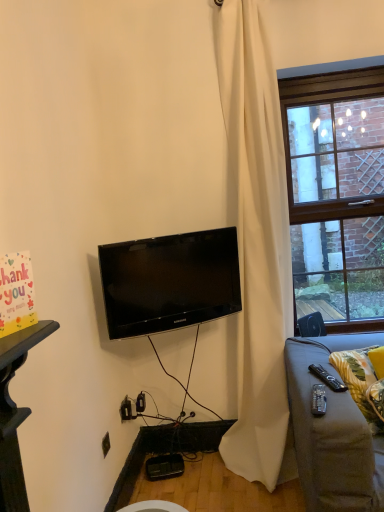
Find the location of a particular element. This screenshot has width=384, height=512. black plastic remote control at lower right, which appears as the first remote control when viewed from the right is located at coordinates (327, 378).

Measure the distance between point (x=342, y=352) and camera.

They are 6.04 feet apart.

Describe the element at coordinates (256, 243) in the screenshot. I see `white matte curtain at center` at that location.

Find the location of a particular element. Image resolution: width=384 pixels, height=512 pixels. black plastic remote control at lower right, marked as the 2th remote control in a back-to-front arrangement is located at coordinates (318, 400).

At what (x,y) coordinates should I click in order to perform the action: click on black plastic remote control at lower right, which ranks as the first remote control in back-to-front order. Please return your answer as a coordinate pair (x, y). This screenshot has height=512, width=384. Looking at the image, I should click on (327, 378).

Measure the distance from brick wall at right to white matte curtain at center.

brick wall at right is 17.11 inches away from white matte curtain at center.

From the image's perspective, is brick wall at right positioned above or below white matte curtain at center?

Clearly, from the image's perspective, brick wall at right is above white matte curtain at center.

Which of these two, brick wall at right or white matte curtain at center, is smaller?

Smaller between the two is brick wall at right.

Is white matte curtain at center located within brick wall at right?

No, white matte curtain at center is not surrounded by brick wall at right.

Considering the relative positions of black glossy tv at center and white matte curtain at center in the image provided, is black glossy tv at center to the left or to the right of white matte curtain at center?

From the image, it's evident that black glossy tv at center is to the left of white matte curtain at center.

Is black glossy tv at center touching white matte curtain at center?

No, black glossy tv at center is not making contact with white matte curtain at center.

Is black glossy tv at center not within white matte curtain at center?

Actually, black glossy tv at center is at least partially inside white matte curtain at center.

Is point (319, 386) positioned in front of point (363, 355)?

Yes.

Can you confirm if black plastic remote control at lower right, which is the 2th remote control from right to left, is taller than yellow fabric pillow at lower right?

In fact, black plastic remote control at lower right, which is the 2th remote control from right to left, may be shorter than yellow fabric pillow at lower right.

From the image's perspective, is black plastic remote control at lower right, acting as the 1th remote control starting from the left, above yellow fabric pillow at lower right?

Yes.

In the image, is black plastic remote control at lower right, acting as the 1th remote control starting from the left, positioned in front of or behind yellow fabric pillow at lower right?

black plastic remote control at lower right, acting as the 1th remote control starting from the left, is positioned closer to the viewer than yellow fabric pillow at lower right.

Is white matte curtain at center completely or partially inside yellow fabric pillow at lower right?

No, white matte curtain at center is not surrounded by yellow fabric pillow at lower right.

Considering the relative sizes of yellow fabric pillow at lower right and white matte curtain at center in the image provided, is yellow fabric pillow at lower right shorter than white matte curtain at center?

Yes, yellow fabric pillow at lower right is shorter than white matte curtain at center.

Is the surface of yellow fabric pillow at lower right in direct contact with white matte curtain at center?

No, yellow fabric pillow at lower right is not beside white matte curtain at center.

Visually, is black plastic remote control at lower right, which appears as the first remote control when viewed from the right, positioned to the left or to the right of brick wall at right?

From the image, it's evident that black plastic remote control at lower right, which appears as the first remote control when viewed from the right, is to the left of brick wall at right.

Looking at the image, does black plastic remote control at lower right, which ranks as the first remote control in back-to-front order, seem bigger or smaller compared to brick wall at right?

Clearly, black plastic remote control at lower right, which ranks as the first remote control in back-to-front order, is smaller in size than brick wall at right.

Is black plastic remote control at lower right, which appears as the first remote control when viewed from the right, thinner than brick wall at right?

No.

From the image's perspective, relative to black plastic remote control at lower right, the first remote control in the front-to-back sequence, is black glossy tv at center above or below?

black glossy tv at center is situated higher than black plastic remote control at lower right, the first remote control in the front-to-back sequence, in the image.

From a real-world perspective, between black glossy tv at center and black plastic remote control at lower right, which is the 2th remote control from right to left, who is vertically higher?

black glossy tv at center.

Is black glossy tv at center not inside black plastic remote control at lower right, which is the 2th remote control from right to left?

Yes, black glossy tv at center is located beyond the bounds of black plastic remote control at lower right, which is the 2th remote control from right to left.

Is point (215, 237) farther from camera compared to point (316, 397)?

Yes, it is behind point (316, 397).

Locate an element on the screen. curtain behind the black plastic remote control at lower right, the 2th remote control from the left is located at coordinates (256, 243).

From the picture: How different are the orientations of black plastic remote control at lower right, the 2th remote control from the left, and white matte curtain at center in degrees?

They differ by 14.4 degrees in their facing directions.

Which is correct: black plastic remote control at lower right, which appears as the first remote control when viewed from the right, is inside white matte curtain at center, or outside of it?

black plastic remote control at lower right, which appears as the first remote control when viewed from the right, is spatially situated outside white matte curtain at center.

Is point (310, 368) closer to camera compared to point (245, 330)?

Yes, it is in front of point (245, 330).

There is a white matte curtain at center. Where is `window above it (from a real-world perspective)`? window above it (from a real-world perspective) is located at coordinates (336, 190).

The width and height of the screenshot is (384, 512). I want to click on television below the white matte curtain at center (from a real-world perspective), so click(169, 281).

Considering their positions, is yellow fabric pillow at lower right positioned further to brick wall at right than black plastic remote control at lower right, which ranks as the first remote control in back-to-front order?

The object further to brick wall at right is black plastic remote control at lower right, which ranks as the first remote control in back-to-front order.

Looking at the image, which one is located closer to brick wall at right, black glossy tv at center or black plastic remote control at lower right, which is the 2th remote control from right to left?

Based on the image, black glossy tv at center appears to be nearer to brick wall at right.

Which object lies further to the anchor point black plastic remote control at lower right, which is the 2th remote control from right to left, brick wall at right or yellow fabric pillow at lower right?

Based on the image, brick wall at right appears to be further to black plastic remote control at lower right, which is the 2th remote control from right to left.

From the image, which object appears to be nearer to black glossy tv at center, white matte curtain at center or black plastic remote control at lower right, which is the 2th remote control from right to left?

white matte curtain at center is positioned closer to the anchor black glossy tv at center.

When comparing their distances from yellow fabric pillow at lower right, does black plastic remote control at lower right, placed as the second remote control when sorted from front to back, or black glossy tv at center seem closer?

black plastic remote control at lower right, placed as the second remote control when sorted from front to back, is positioned closer to the anchor yellow fabric pillow at lower right.

Considering their positions, is black plastic remote control at lower right, placed as the second remote control when sorted from front to back, positioned further to yellow fabric pillow at lower right than white matte curtain at center?

Among the two, white matte curtain at center is located further to yellow fabric pillow at lower right.

Which object lies nearer to the anchor point brick wall at right, black plastic remote control at lower right, the first remote control in the front-to-back sequence, or white matte curtain at center?

Among the two, white matte curtain at center is located nearer to brick wall at right.

Estimate the real-world distances between objects in this image. Which object is further from black glossy tv at center, brick wall at right or white matte curtain at center?

brick wall at right lies further to black glossy tv at center than the other object.

The image size is (384, 512). Find the location of `remote control that lies between white matte curtain at center and black plastic remote control at lower right, marked as the 2th remote control in a back-to-front arrangement, from top to bottom`. remote control that lies between white matte curtain at center and black plastic remote control at lower right, marked as the 2th remote control in a back-to-front arrangement, from top to bottom is located at coordinates coord(327,378).

You are a GUI agent. You are given a task and a screenshot of the screen. Output one action in this format:
    pyautogui.click(x=<x>, y=<y>)
    Task: Click on the curtain between brick wall at right and black plastic remote control at lower right, which appears as the first remote control when viewed from the right, vertically
    
    Given the screenshot: What is the action you would take?
    pyautogui.click(x=256, y=243)

Where is `television between white matte curtain at center and black plastic remote control at lower right, which is the 2th remote control from right to left, in the vertical direction`? This screenshot has width=384, height=512. television between white matte curtain at center and black plastic remote control at lower right, which is the 2th remote control from right to left, in the vertical direction is located at coordinates (169, 281).

This screenshot has height=512, width=384. Find the location of `remote control between black glossy tv at center and black plastic remote control at lower right, which ranks as the first remote control in back-to-front order, in the horizontal direction`. remote control between black glossy tv at center and black plastic remote control at lower right, which ranks as the first remote control in back-to-front order, in the horizontal direction is located at coordinates (318, 400).